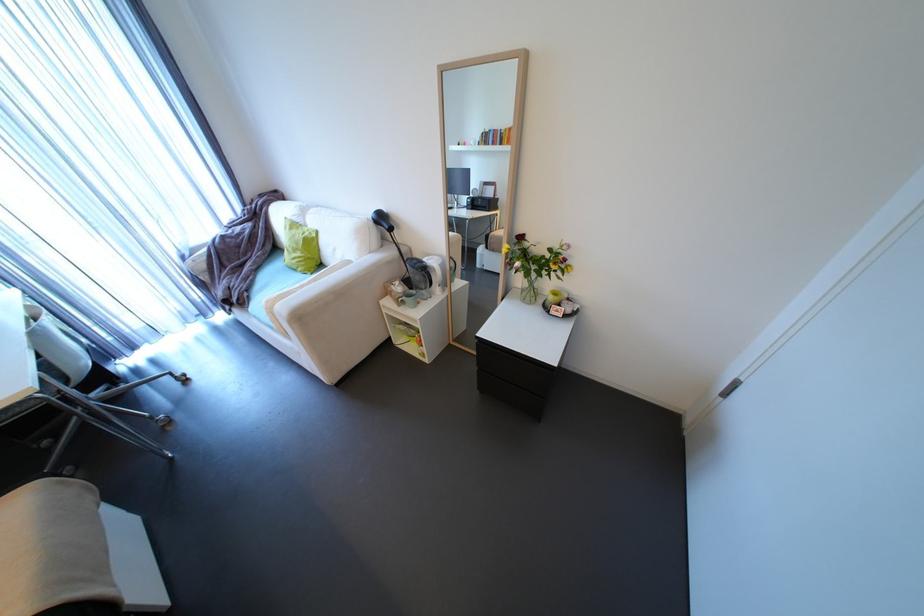
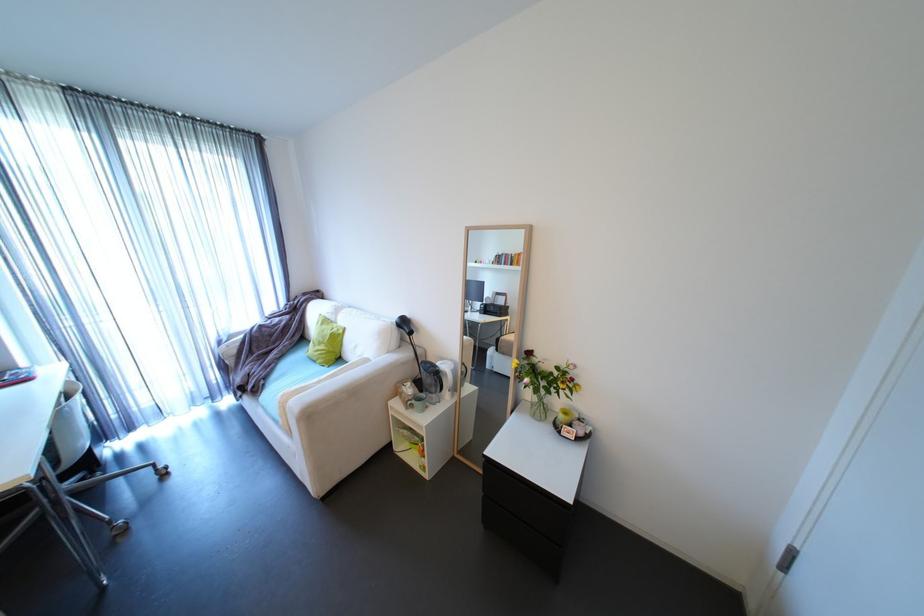
Question: Which direction would the cameraman need to move to produce the second image? Reply with the corresponding letter.

Choices:
 (A) Left
 (B) Right
 (C) Forward
 (D) Backward

Answer: (D)